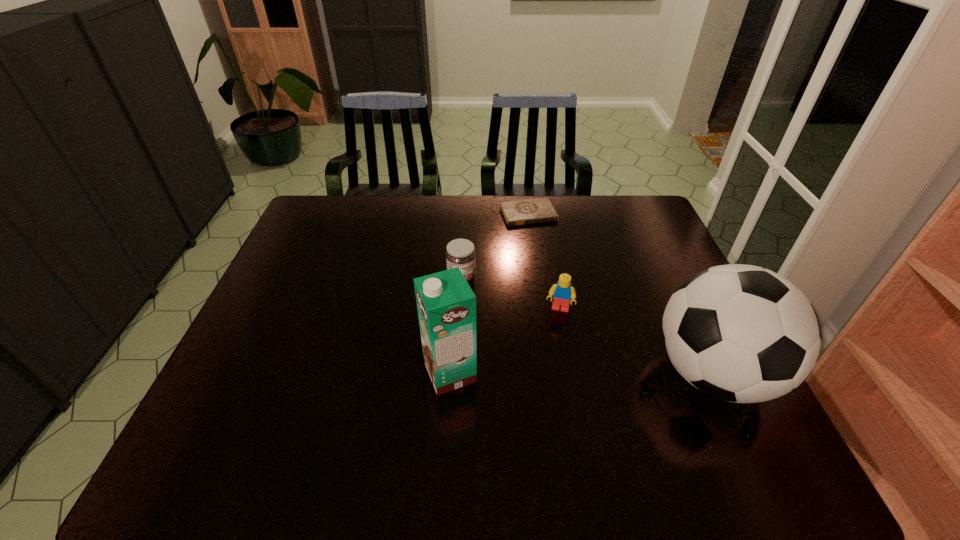
Locate an element on the screen. Image resolution: width=960 pixels, height=540 pixels. object located in the right edge section of the desktop is located at coordinates (741, 333).

Locate an element on the screen. The image size is (960, 540). object located at the near right corner is located at coordinates (741, 333).

The width and height of the screenshot is (960, 540). In the image, there is a desktop. What are the coordinates of `vacant region at the far edge` in the screenshot? It's located at (463, 212).

You are a GUI agent. You are given a task and a screenshot of the screen. Output one action in this format:
    pyautogui.click(x=<x>, y=<y>)
    Task: Click on the blank space at the near edge
    The image size is (960, 540).
    Given the screenshot: What is the action you would take?
    pyautogui.click(x=540, y=421)

The image size is (960, 540). I want to click on vacant space at the left edge, so click(x=283, y=278).

Locate an element on the screen. The height and width of the screenshot is (540, 960). free region at the right edge of the desktop is located at coordinates (639, 293).

In order to click on free region at the far left corner in this screenshot , I will do `click(345, 206)`.

You are a GUI agent. You are given a task and a screenshot of the screen. Output one action in this format:
    pyautogui.click(x=<x>, y=<y>)
    Task: Click on the vacant space at the far right corner
    This screenshot has width=960, height=540.
    Given the screenshot: What is the action you would take?
    pyautogui.click(x=601, y=195)

What are the coordinates of `empty space between the fourth nearest object and the diary` in the screenshot? It's located at pyautogui.click(x=495, y=246).

The width and height of the screenshot is (960, 540). Find the location of `unoccupied position between the fourth nearest object and the farthest object`. unoccupied position between the fourth nearest object and the farthest object is located at coordinates (495, 246).